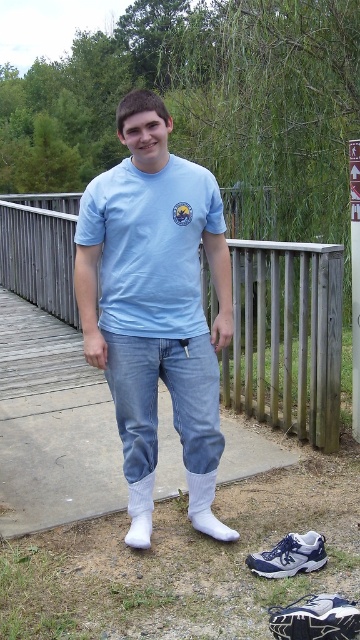
Can you confirm if white mesh shoe at lower right is positioned to the left of white cotton sock at lower center?

No, white mesh shoe at lower right is not to the left of white cotton sock at lower center.

Does white mesh shoe at lower right have a lesser height compared to white cotton sock at lower center?

Correct, white mesh shoe at lower right is not as tall as white cotton sock at lower center.

This screenshot has height=640, width=360. What do you see at coordinates (315, 618) in the screenshot?
I see `white mesh shoe at lower right` at bounding box center [315, 618].

Image resolution: width=360 pixels, height=640 pixels. I want to click on white mesh shoe at lower right, so click(315, 618).

From the picture: Which of these two, light blue cotton t-shirt at center or white mesh shoe at lower right, stands taller?

light blue cotton t-shirt at center is taller.

Between light blue cotton t-shirt at center and white mesh shoe at lower right, which one is positioned higher?

light blue cotton t-shirt at center

Does point (140, 179) come closer to viewer compared to point (308, 612)?

That is False.

This screenshot has height=640, width=360. I want to click on light blue cotton t-shirt at center, so click(150, 244).

Looking at this image, which of these two, blue denim jeans at center or white fabric sock at lower center, stands taller?

Standing taller between the two is blue denim jeans at center.

Is point (46, 284) more distant than point (191, 493)?

Yes, it is.

Find the location of `blue denim jeans at center`. blue denim jeans at center is located at coordinates (286, 337).